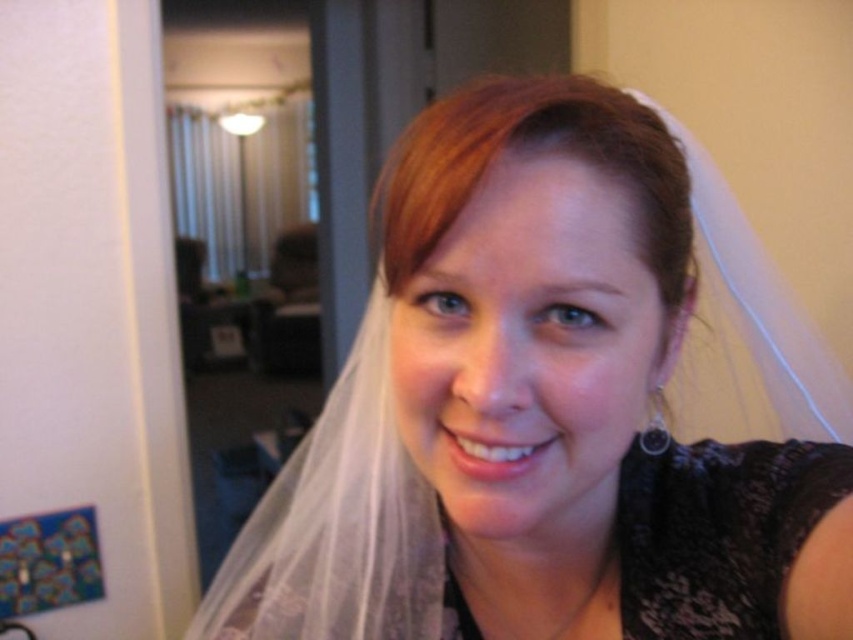
Between translucent white veil at center and blonde silky hair at center, which one has more height?

translucent white veil at center is taller.

Does translucent white veil at center appear over blonde silky hair at center?

No.

The width and height of the screenshot is (853, 640). Describe the element at coordinates (546, 408) in the screenshot. I see `translucent white veil at center` at that location.

This screenshot has width=853, height=640. In order to click on translucent white veil at center in this screenshot , I will do `click(546, 408)`.

Consider the image. Can you confirm if black lace dress at lower right is positioned above blonde silky hair at center?

No, black lace dress at lower right is not above blonde silky hair at center.

Based on the photo, does black lace dress at lower right appear on the left side of blonde silky hair at center?

In fact, black lace dress at lower right is to the right of blonde silky hair at center.

The width and height of the screenshot is (853, 640). Describe the element at coordinates (718, 532) in the screenshot. I see `black lace dress at lower right` at that location.

Identify the location of black lace dress at lower right. The height and width of the screenshot is (640, 853). (718, 532).

Does translucent white veil at center have a smaller size compared to black lace dress at lower right?

No, translucent white veil at center is not smaller than black lace dress at lower right.

Does translucent white veil at center have a greater width compared to black lace dress at lower right?

Yes.

Measure the distance between point (x=256, y=563) and camera.

Point (x=256, y=563) and camera are 1.27 meters apart.

Where is `translucent white veil at center`? The height and width of the screenshot is (640, 853). translucent white veil at center is located at coordinates (546, 408).